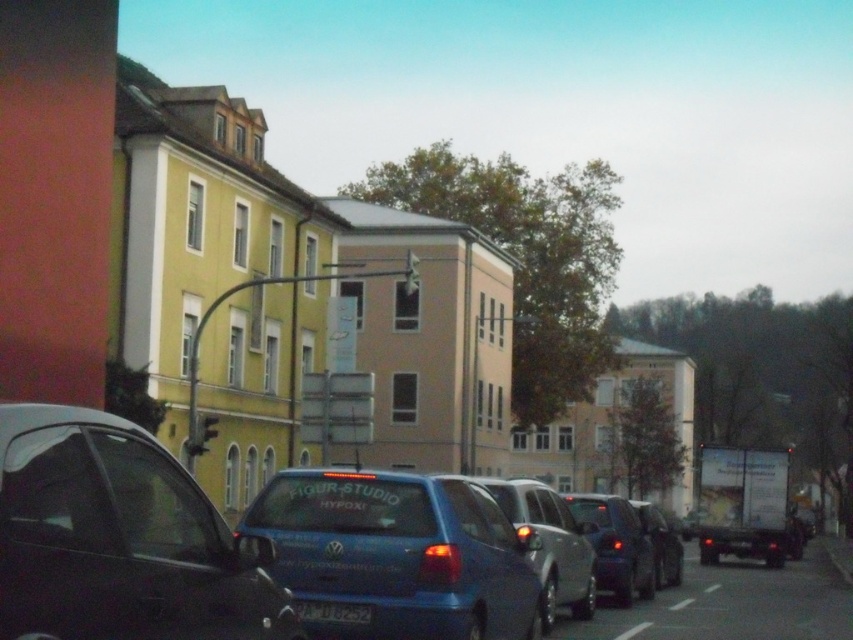
Which is more to the right, blue matte car at center or metallic blue sedan at center?

metallic blue sedan at center is more to the right.

Is blue matte car at center bigger than metallic blue sedan at center?

Actually, blue matte car at center might be smaller than metallic blue sedan at center.

Does point (393, 636) come closer to viewer compared to point (659, 525)?

Yes.

Locate an element on the screen. blue matte car at center is located at coordinates (397, 554).

What do you see at coordinates (549, 545) in the screenshot? I see `blue metallic car at center` at bounding box center [549, 545].

Does blue metallic car at center have a greater width compared to metallic gray traffic light at center?

Correct, the width of blue metallic car at center exceeds that of metallic gray traffic light at center.

Between point (543, 600) and point (213, 420), which one is positioned in front?

Point (543, 600)

Locate an element on the screen. blue metallic car at center is located at coordinates (549, 545).

Between shiny black sedan at center and metallic gray traffic light at center, which one appears on the left side from the viewer's perspective?

metallic gray traffic light at center

Is point (567, 497) behind point (212, 420)?

No, it is in front of (212, 420).

Between point (581, 518) and point (216, 417), which one is positioned behind?

Positioned behind is point (216, 417).

You are a GUI agent. You are given a task and a screenshot of the screen. Output one action in this format:
    pyautogui.click(x=<x>, y=<y>)
    Task: Click on the shiny black sedan at center
    Image resolution: width=853 pixels, height=640 pixels.
    Given the screenshot: What is the action you would take?
    pyautogui.click(x=614, y=545)